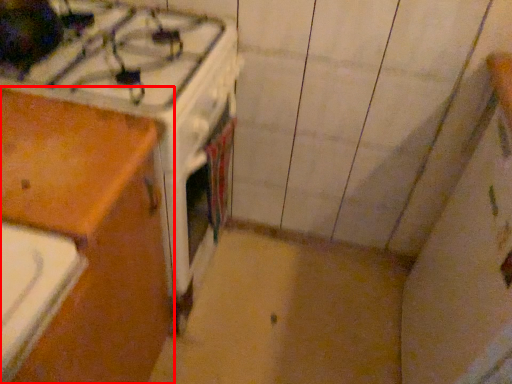
Question: From the image's perspective, considering the relative positions of cabinetry (annotated by the red box) and gas stove in the image provided, where is cabinetry (annotated by the red box) located with respect to the staircase?

Choices:
 (A) above
 (B) below

Answer: (B)